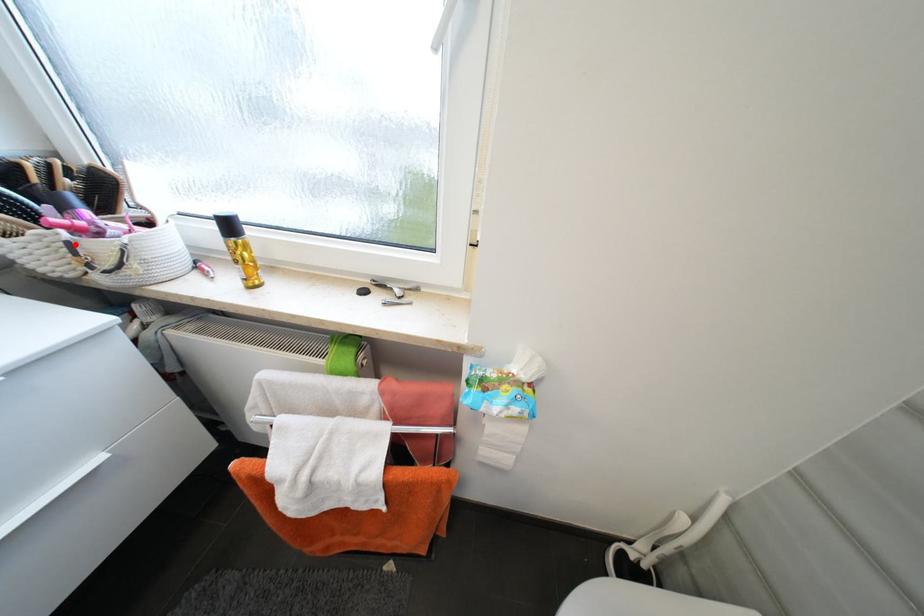
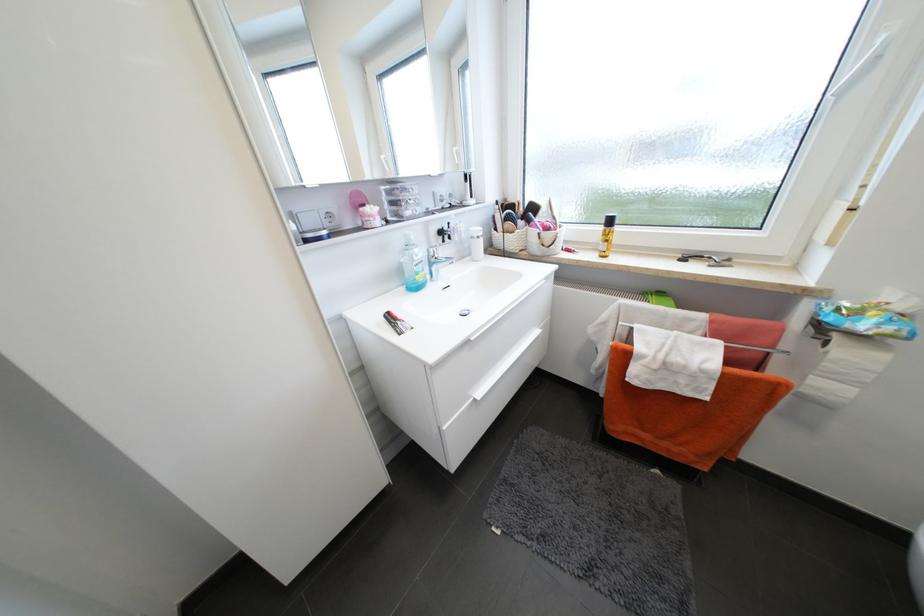
Find the pixel in the second image that matches the highlighted location in the first image.

(544, 235)